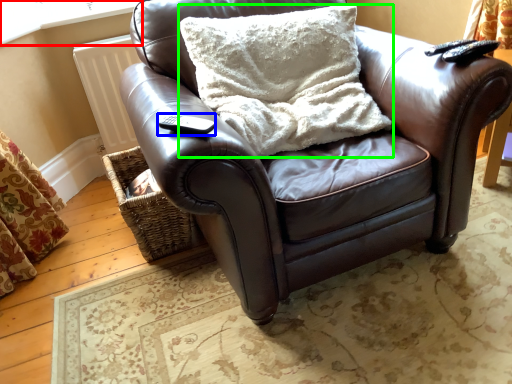
Question: Estimate the real-world distances between objects in this image. Which object is farther from window frame (highlighted by a red box), remote (highlighted by a blue box) or pillow (highlighted by a green box)?

Choices:
 (A) remote
 (B) pillow

Answer: (A)